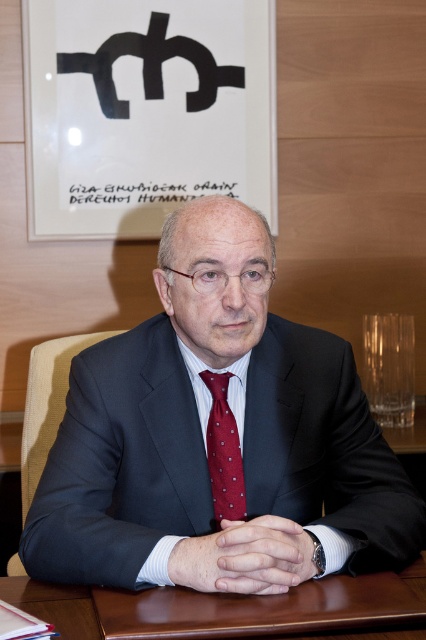
Question: Among these points, which one is farthest from the camera?

Choices:
 (A) (86, 568)
 (B) (40, 616)
 (C) (215, 426)

Answer: (C)

Question: Can you confirm if dark suit at center is smaller than brown wooden table at center?

Choices:
 (A) yes
 (B) no

Answer: (B)

Question: Which of the following is the farthest from the observer?

Choices:
 (A) (232, 458)
 (B) (230, 401)

Answer: (B)

Question: Does brown wooden table at center have a larger size compared to polished silk tie at center?

Choices:
 (A) yes
 (B) no

Answer: (A)

Question: Estimate the real-world distances between objects in this image. Which object is farther from the dark suit at center?

Choices:
 (A) white textured dress shirt at center
 (B) polished silk tie at center
 (C) brown wooden table at center

Answer: (C)

Question: Is brown wooden table at center positioned behind polished silk tie at center?

Choices:
 (A) yes
 (B) no

Answer: (B)